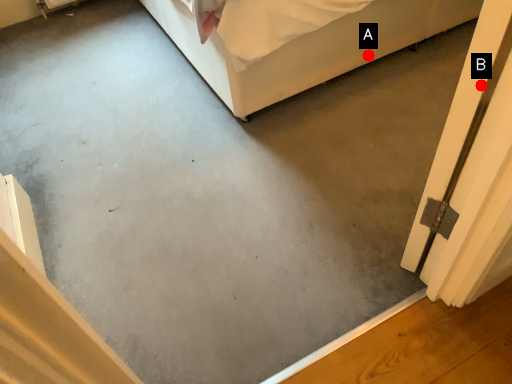
Question: Two points are circled on the image, labeled by A and B beside each circle. Which point is further to the camera?

Choices:
 (A) A is further
 (B) B is further

Answer: (A)